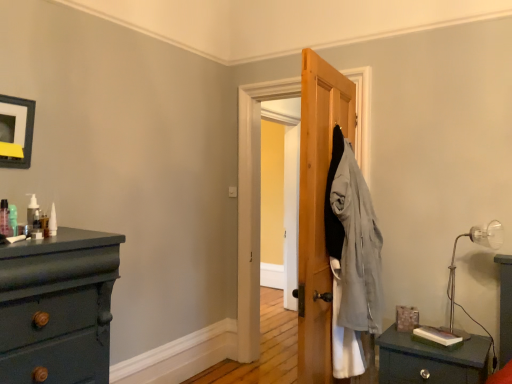
Identify the location of free space above matte black nightstand at lower right (from a real-world perspective). The width and height of the screenshot is (512, 384). (445, 336).